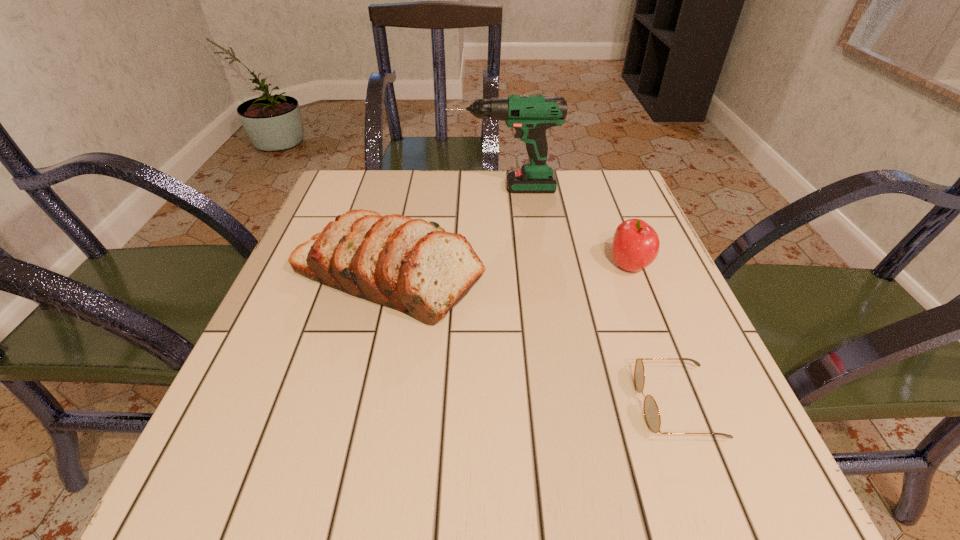
Locate an element on the screen. Image resolution: width=960 pixels, height=540 pixels. free space between the bread and the nearest object is located at coordinates (532, 340).

Locate an element on the screen. Image resolution: width=960 pixels, height=540 pixels. free space between the farthest object and the shortest object is located at coordinates (589, 296).

Locate an element on the screen. This screenshot has width=960, height=540. empty location between the apple and the bread is located at coordinates (509, 271).

At what (x,y) coordinates should I click in order to perform the action: click on free space between the nearest object and the farthest object. Please return your answer as a coordinate pair (x, y). This screenshot has width=960, height=540. Looking at the image, I should click on (589, 296).

Where is `the closest object relative to the tallest object`? the closest object relative to the tallest object is located at coordinates (410, 265).

Identify which object is located as the nearest to the bread. Please provide its 2D coordinates. Your answer should be formatted as a tuple, i.e. [(x, y)], where the tuple contains the x and y coordinates of a point satisfying the conditions above.

[(530, 115)]

Locate an element on the screen. free location that satisfies the following two spatial constraints: 1. on the handle side of the apple; 2. on the left side of the farthest object is located at coordinates (509, 266).

I want to click on vacant region that satisfies the following two spatial constraints: 1. on the handle side of the apple; 2. on the left side of the drill, so click(509, 266).

At what (x,y) coordinates should I click in order to perform the action: click on free space in the image that satisfies the following two spatial constraints: 1. on the front side of the apple; 2. on the lenses of the shortest object. Please return your answer as a coordinate pair (x, y). Looking at the image, I should click on (684, 404).

You are a GUI agent. You are given a task and a screenshot of the screen. Output one action in this format:
    pyautogui.click(x=<x>, y=<y>)
    Task: Click on the vacant space that satisfies the following two spatial constraints: 1. on the handle side of the farthest object; 2. on the left side of the apple
    The width and height of the screenshot is (960, 540).
    Given the screenshot: What is the action you would take?
    pyautogui.click(x=509, y=266)